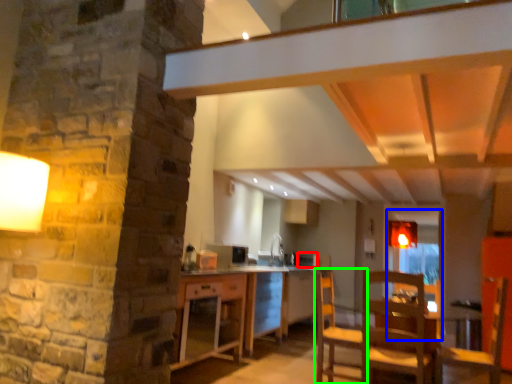
Question: Estimate the real-world distances between objects in this image. Which object is closer to appliance (highlighted by a red box), glass door (highlighted by a blue box) or chair (highlighted by a green box)?

Choices:
 (A) glass door
 (B) chair

Answer: (A)